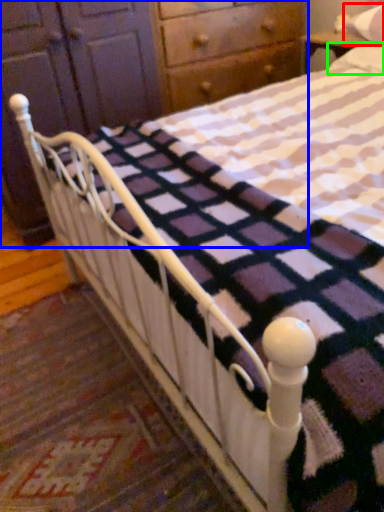
Question: Considering the real-world distances, which object is farthest from pillow (highlighted by a red box)? dresser (highlighted by a blue box) or pillow (highlighted by a green box)?

Choices:
 (A) dresser
 (B) pillow

Answer: (A)